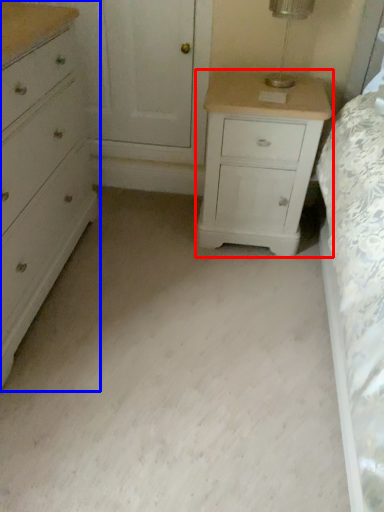
Question: Which point is further to the camera, nightstand (highlighted by a red box) or chest of drawers (highlighted by a blue box)?

Choices:
 (A) nightstand
 (B) chest of drawers

Answer: (A)